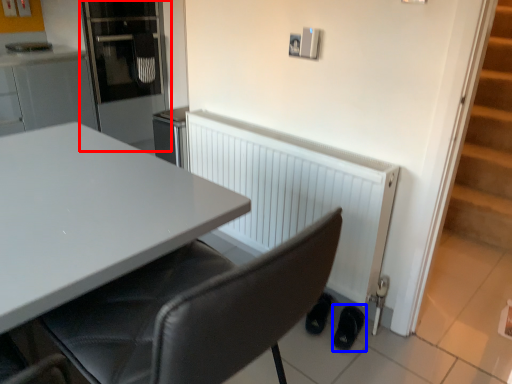
Question: Which of the following is the farthest to the observer, appliance (highlighted by a red box) or footwear (highlighted by a blue box)?

Choices:
 (A) appliance
 (B) footwear

Answer: (A)